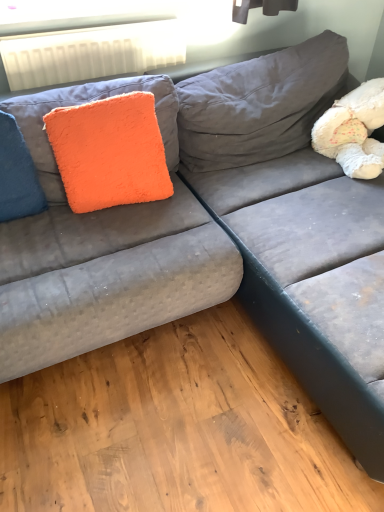
The height and width of the screenshot is (512, 384). What do you see at coordinates (17, 174) in the screenshot?
I see `blue fuzzy pillow at left` at bounding box center [17, 174].

The height and width of the screenshot is (512, 384). Identify the location of white fluffy teddy bear at upper right. coord(353,131).

In order to face white plastic radiator at upper left, should I rotate leftwards or rightwards?

You should rotate left by 12.311 degrees.

Locate an element on the screen. The image size is (384, 512). blue fuzzy pillow at left is located at coordinates (17, 174).

In the scene shown: Does orange fluffy pillow at upper left turn towards white fluffy teddy bear at upper right?

No, orange fluffy pillow at upper left is not aimed at white fluffy teddy bear at upper right.

From the image's perspective, is orange fluffy pillow at upper left over white fluffy teddy bear at upper right?

No, from the image's perspective, orange fluffy pillow at upper left is not over white fluffy teddy bear at upper right.

Based on the photo, which object is closer to the camera taking this photo, orange fluffy pillow at upper left or white fluffy teddy bear at upper right?

orange fluffy pillow at upper left is closer to the camera.

Between point (73, 148) and point (371, 96), which one is positioned behind?

Point (371, 96)

Considering the sizes of objects blue fuzzy pillow at left and white plastic radiator at upper left in the image provided, who is wider, blue fuzzy pillow at left or white plastic radiator at upper left?

blue fuzzy pillow at left is wider.

How many degrees apart are the facing directions of blue fuzzy pillow at left and white plastic radiator at upper left?

blue fuzzy pillow at left and white plastic radiator at upper left are facing 0.721 degrees away from each other.

Could you tell me if blue fuzzy pillow at left is facing white plastic radiator at upper left?

No, blue fuzzy pillow at left is not turned towards white plastic radiator at upper left.

Is blue fuzzy pillow at left next to white plastic radiator at upper left and touching it?

blue fuzzy pillow at left and white plastic radiator at upper left are clearly separated.

From a real-world perspective, which is physically below, white fluffy teddy bear at upper right or orange fluffy pillow at upper left?

From a 3D spatial view, white fluffy teddy bear at upper right is below.

Considering the sizes of objects white fluffy teddy bear at upper right and orange fluffy pillow at upper left in the image provided, who is wider, white fluffy teddy bear at upper right or orange fluffy pillow at upper left?

white fluffy teddy bear at upper right.

Is orange fluffy pillow at upper left located within white fluffy teddy bear at upper right?

No, orange fluffy pillow at upper left is not inside white fluffy teddy bear at upper right.

Between point (375, 167) and point (129, 200), which one is positioned in front?

The point (129, 200) is more forward.

Would you say white plastic radiator at upper left is outside blue fuzzy pillow at left?

Absolutely, white plastic radiator at upper left is external to blue fuzzy pillow at left.

Is white plastic radiator at upper left far away from blue fuzzy pillow at left?

white plastic radiator at upper left is near blue fuzzy pillow at left, not far away.

Which object is thinner, white plastic radiator at upper left or blue fuzzy pillow at left?

white plastic radiator at upper left is thinner.

Is white plastic radiator at upper left turned away from blue fuzzy pillow at left?

No, white plastic radiator at upper left's orientation is not away from blue fuzzy pillow at left.

From a real-world perspective, is white fluffy teddy bear at upper right below blue fuzzy pillow at left?

Yes.

Is white fluffy teddy bear at upper right at the left side of blue fuzzy pillow at left?

No.

Are white fluffy teddy bear at upper right and blue fuzzy pillow at left far apart?

Absolutely, white fluffy teddy bear at upper right is distant from blue fuzzy pillow at left.

Would you say orange fluffy pillow at upper left is a long distance from blue fuzzy pillow at left?

No, orange fluffy pillow at upper left is in close proximity to blue fuzzy pillow at left.

Does orange fluffy pillow at upper left lie in front of blue fuzzy pillow at left?

No, orange fluffy pillow at upper left is behind blue fuzzy pillow at left.

Identify the location of throw pillow on the right of blue fuzzy pillow at left. (109, 152).

Is blue fuzzy pillow at left not within white fluffy teddy bear at upper right?

Yes, blue fuzzy pillow at left is not within white fluffy teddy bear at upper right.

Which is nearer, (41,202) or (345,164)?

Point (41,202) appears to be closer to the viewer than point (345,164).

Can you confirm if blue fuzzy pillow at left is taller than white fluffy teddy bear at upper right?

Yes.

From the image's perspective, is blue fuzzy pillow at left below white fluffy teddy bear at upper right?

Correct, blue fuzzy pillow at left appears lower than white fluffy teddy bear at upper right in the image.

Locate an element on the screen. The height and width of the screenshot is (512, 384). throw pillow that appears in front of the white fluffy teddy bear at upper right is located at coordinates (109, 152).

At what (x,y) coordinates should I click in order to perform the action: click on radiator positioned vertically above the blue fuzzy pillow at left (from a real-world perspective). Please return your answer as a coordinate pair (x, y). Looking at the image, I should click on (91, 53).

When comparing their distances from white fluffy teddy bear at upper right, does orange fluffy pillow at upper left or blue fuzzy pillow at left seem closer?

orange fluffy pillow at upper left is closer to white fluffy teddy bear at upper right.

Considering their positions, is white plastic radiator at upper left positioned closer to white fluffy teddy bear at upper right than orange fluffy pillow at upper left?

orange fluffy pillow at upper left is closer to white fluffy teddy bear at upper right.

Estimate the real-world distances between objects in this image. Which object is further from blue fuzzy pillow at left, orange fluffy pillow at upper left or white fluffy teddy bear at upper right?

The object further to blue fuzzy pillow at left is white fluffy teddy bear at upper right.

Estimate the real-world distances between objects in this image. Which object is closer to white fluffy teddy bear at upper right, blue fuzzy pillow at left or white plastic radiator at upper left?

Among the two, white plastic radiator at upper left is located nearer to white fluffy teddy bear at upper right.

When comparing their distances from white fluffy teddy bear at upper right, does orange fluffy pillow at upper left or white plastic radiator at upper left seem closer?

orange fluffy pillow at upper left lies closer to white fluffy teddy bear at upper right than the other object.

From the image, which object appears to be nearer to white plastic radiator at upper left, orange fluffy pillow at upper left or white fluffy teddy bear at upper right?

orange fluffy pillow at upper left.

Based on their spatial positions, is white fluffy teddy bear at upper right or blue fuzzy pillow at left further from orange fluffy pillow at upper left?

white fluffy teddy bear at upper right is further to orange fluffy pillow at upper left.

Considering their positions, is blue fuzzy pillow at left positioned further to white fluffy teddy bear at upper right than orange fluffy pillow at upper left?

blue fuzzy pillow at left is further to white fluffy teddy bear at upper right.

Identify the location of throw pillow that lies between white plastic radiator at upper left and blue fuzzy pillow at left from top to bottom. (109, 152).

Locate an element on the screen. The image size is (384, 512). throw pillow between blue fuzzy pillow at left and white fluffy teddy bear at upper right from left to right is located at coordinates (109, 152).

Find the location of `throw pillow between white plastic radiator at upper left and white fluffy teddy bear at upper right in the horizontal direction`. throw pillow between white plastic radiator at upper left and white fluffy teddy bear at upper right in the horizontal direction is located at coordinates (109, 152).

Where is `radiator between blue fuzzy pillow at left and white fluffy teddy bear at upper right from left to right`? radiator between blue fuzzy pillow at left and white fluffy teddy bear at upper right from left to right is located at coordinates (91, 53).